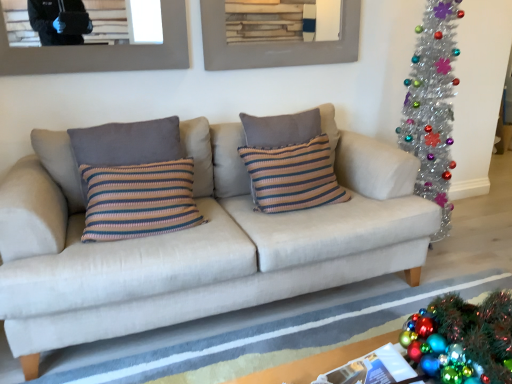
Find the location of a particular element. vacant area situated below wooden frame at upper center, the second picture frame from the left (from a real-world perspective) is located at coordinates (278, 97).